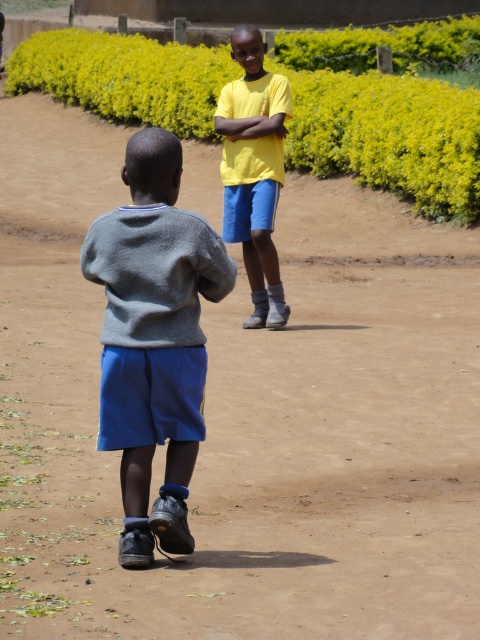
Find the location of a particular element. This screenshot has width=480, height=640. gray cotton sweater at center is located at coordinates [x=154, y=339].

Is point (182, 360) closer to camera compared to point (259, 241)?

Yes, it is.

Identify the location of gray cotton sweater at center. (154, 339).